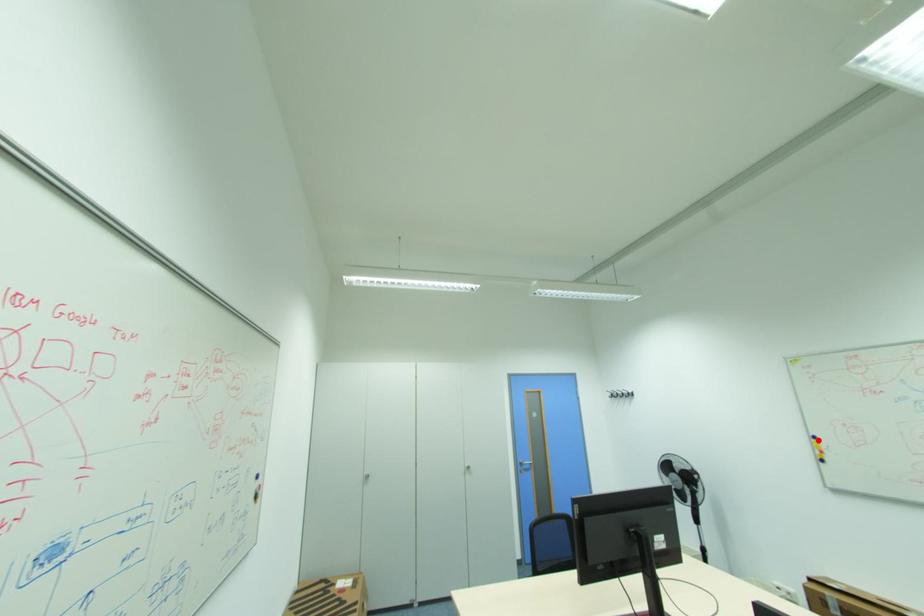
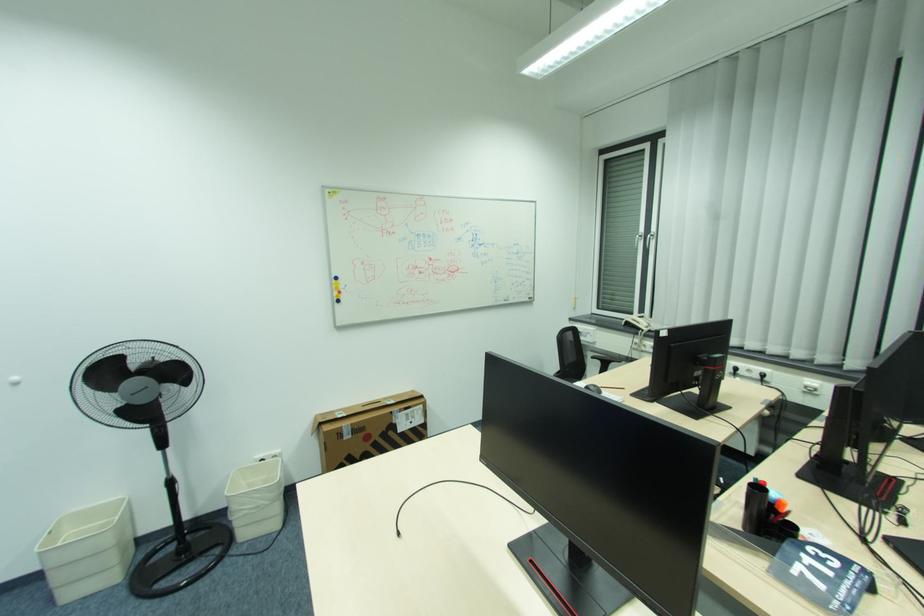
Question: I am providing you with two images of the same scene from different viewpoints. A red point is shown in image1. For the corresponding object point in image2, is it positioned nearer or farther from the camera?

Choices:
 (A) Nearer
 (B) Farther

Answer: (B)